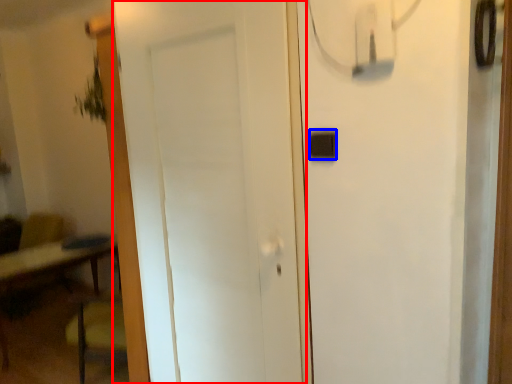
Question: Among these objects, which one is nearest to the camera, door (highlighted by a red box) or light switch (highlighted by a blue box)?

Choices:
 (A) door
 (B) light switch

Answer: (A)